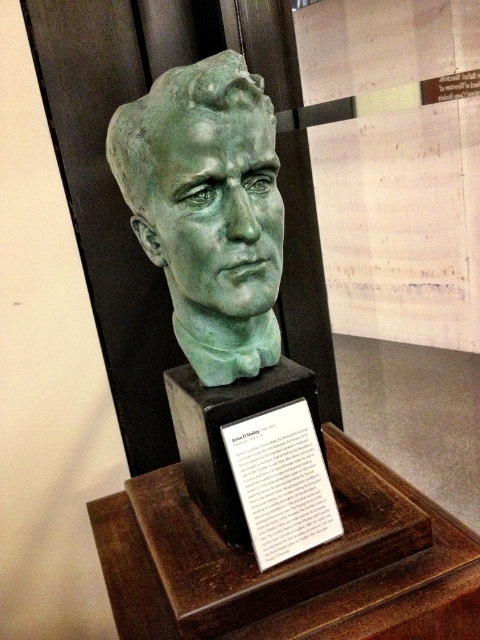
Can you confirm if green patina bust at center is shorter than white paper at center?

In fact, green patina bust at center may be taller than white paper at center.

Can you confirm if green patina bust at center is bigger than white paper at center?

Correct, green patina bust at center is larger in size than white paper at center.

Between point (227, 198) and point (314, 522), which one is positioned behind?

Point (314, 522)

Where is `green patina bust at center`? Image resolution: width=480 pixels, height=640 pixels. green patina bust at center is located at coordinates (204, 182).